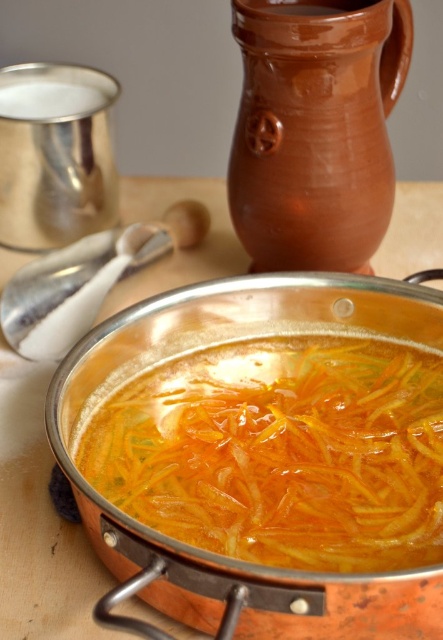
Question: Can you confirm if slightly translucent orange shredded carrots at center is positioned above white plastic spoon at upper left?

Choices:
 (A) no
 (B) yes

Answer: (A)

Question: Which of these objects is positioned farthest from the slightly translucent orange shredded carrots at center?

Choices:
 (A) brown clay pitcher at upper center
 (B) white plastic spoon at upper left

Answer: (A)

Question: Which of the following is the farthest from the observer?

Choices:
 (A) shiny copper pot at center
 (B) white plastic spoon at upper left

Answer: (B)

Question: Is brown clay pitcher at upper center further to camera compared to shiny copper pot at center?

Choices:
 (A) no
 (B) yes

Answer: (B)

Question: Is shiny copper pot at center to the right of white plastic spoon at upper left from the viewer's perspective?

Choices:
 (A) yes
 (B) no

Answer: (A)

Question: Which object is positioned farthest from the brown clay pitcher at upper center?

Choices:
 (A) white plastic spoon at upper left
 (B) slightly translucent orange shredded carrots at center
 (C) shiny copper pot at center

Answer: (B)